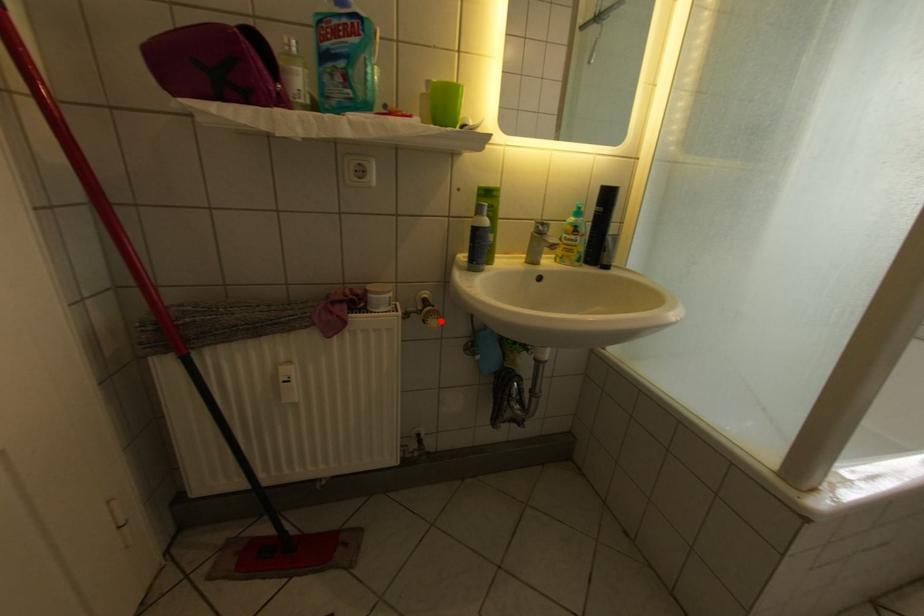
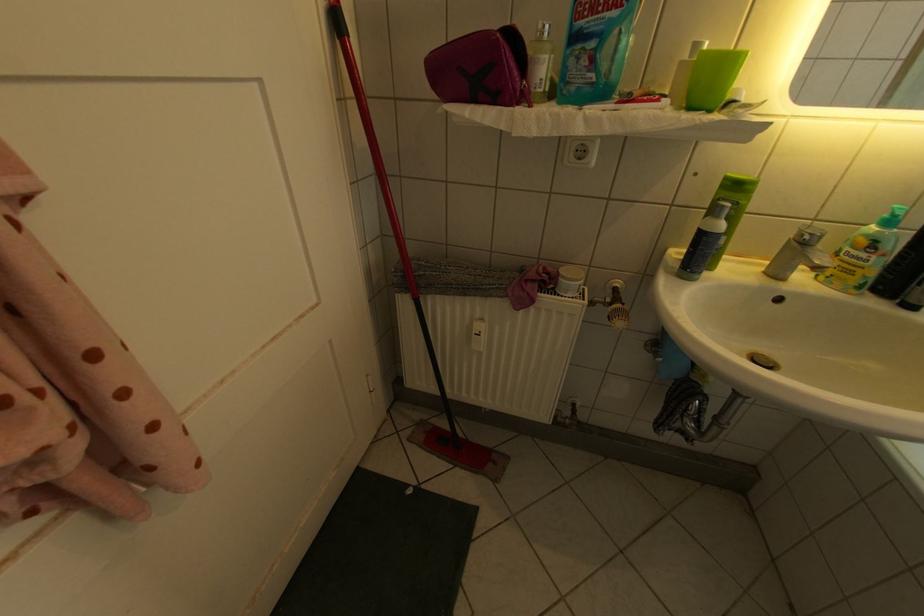
Question: I am providing you with two images of the same scene from different viewpoints. A red point is shown in image1. For the corresponding object point in image2, is it positioned nearer or farther from the camera?

Choices:
 (A) Nearer
 (B) Farther

Answer: (A)